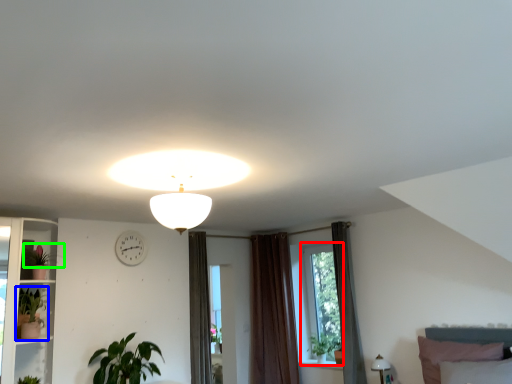
Question: Considering the real-world distances, which object is closest to window (highlighted by a red box)? houseplant (highlighted by a blue box) or plant (highlighted by a green box).

Choices:
 (A) houseplant
 (B) plant

Answer: (A)